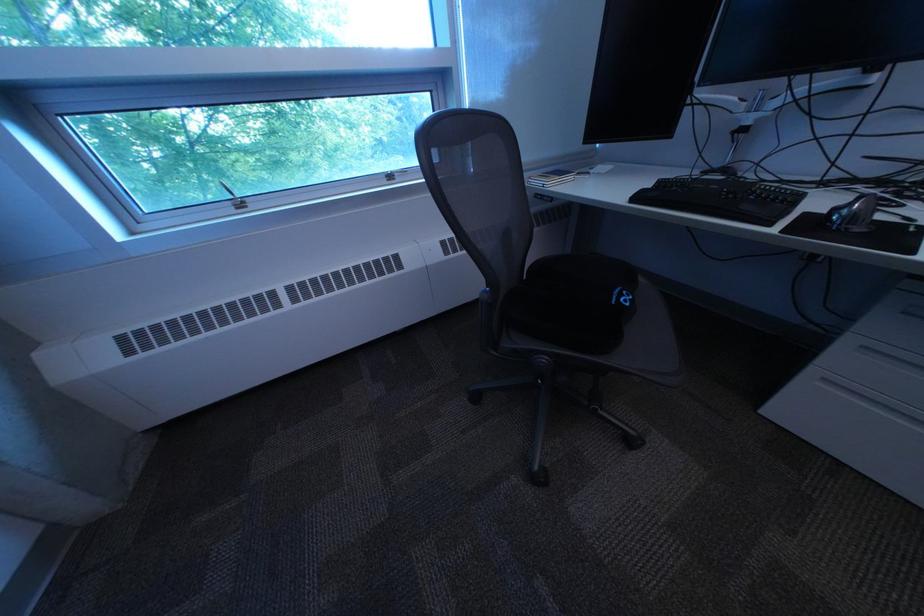
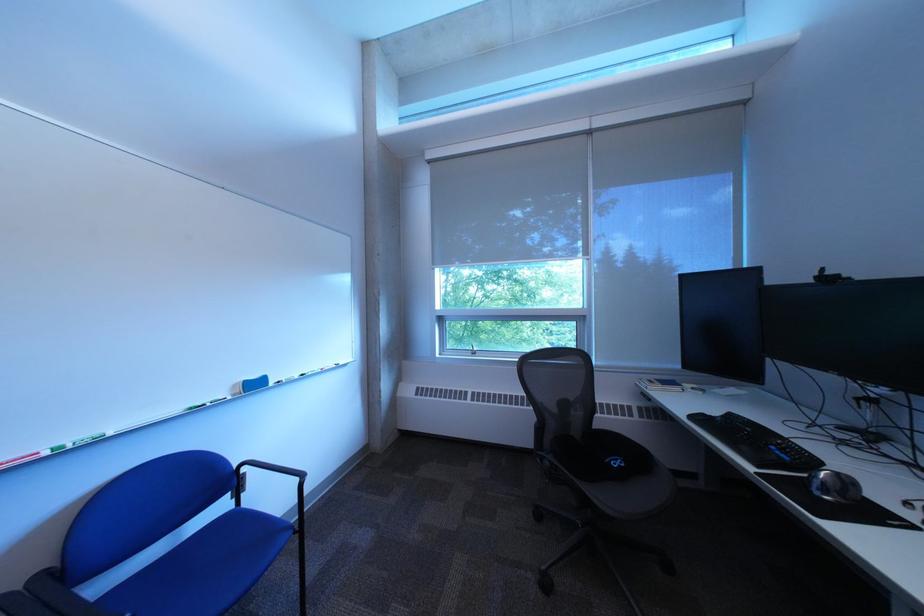
Where in the second image is the point corresponding to point (247, 198) from the first image?

(488, 351)